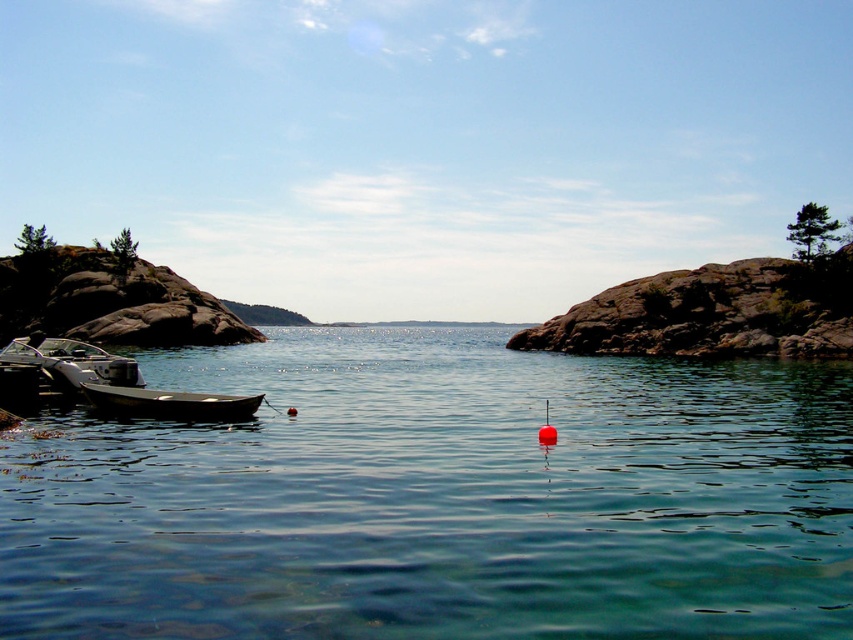
In the scene shown: You are a photographer planning to take a photo of the metallic gray boat at left and the smooth dark wood canoe at left. Since you want both objects to be clearly visible in your shot, which one should you focus on first to ensure proper depth of field?

The metallic gray boat at left is located above the smooth dark wood canoe at left, so you should focus on the metallic gray boat at left first to ensure both are in focus.